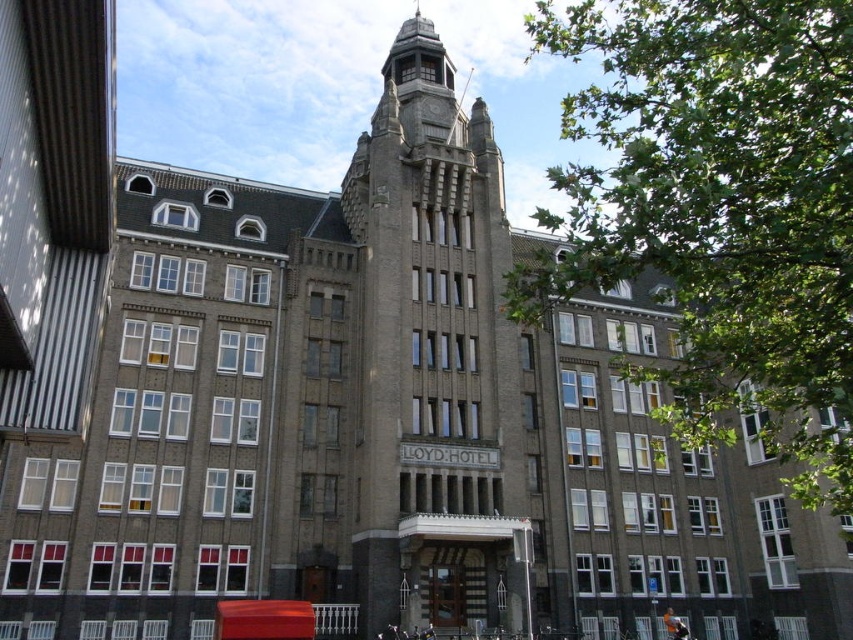
Can you confirm if green leafy tree at upper right is positioned to the right of brown stone tower at center?

Indeed, green leafy tree at upper right is positioned on the right side of brown stone tower at center.

Is green leafy tree at upper right above brown stone tower at center?

Indeed, green leafy tree at upper right is positioned over brown stone tower at center.

Is point (833, 392) farther from camera compared to point (401, 486)?

No, it is not.

This screenshot has width=853, height=640. I want to click on green leafy tree at upper right, so click(x=718, y=209).